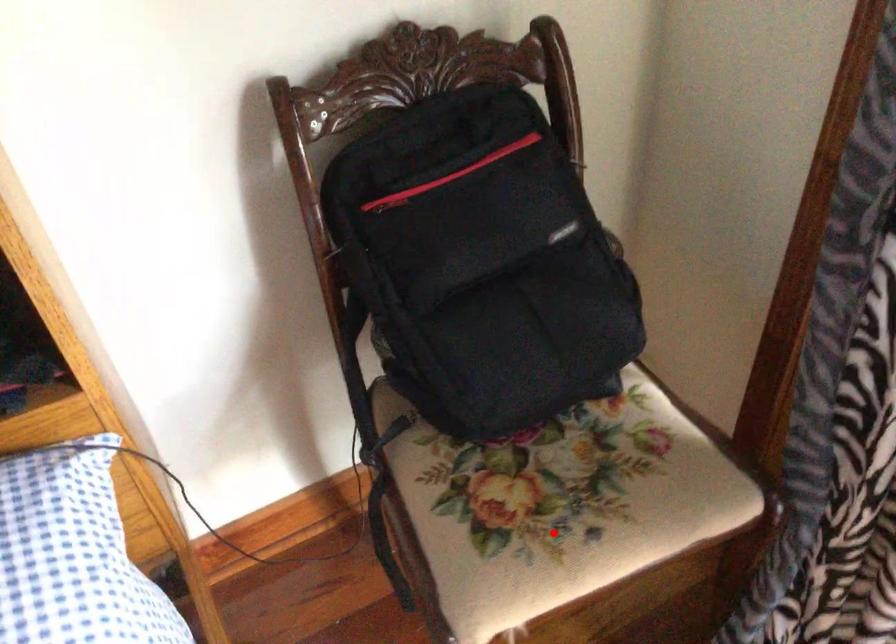
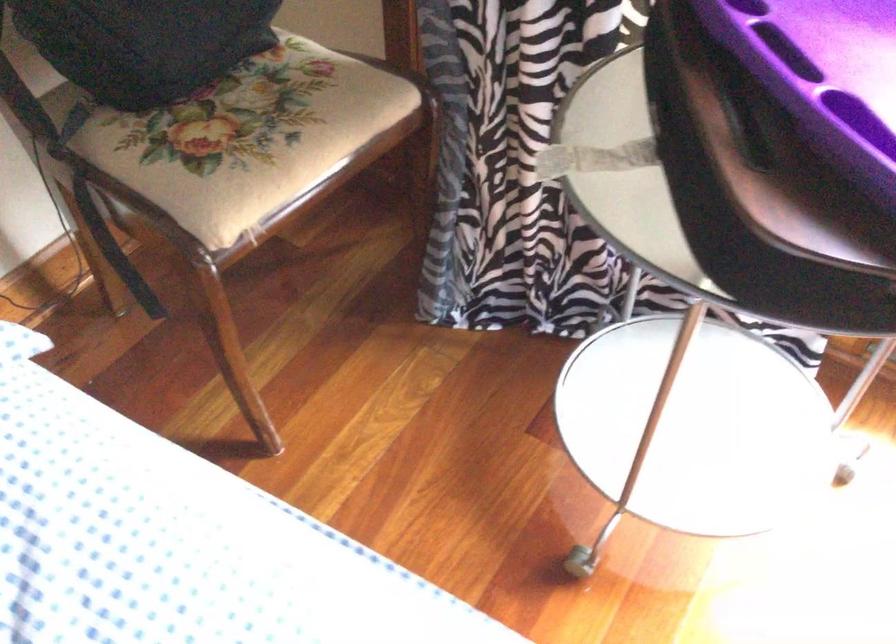
In the second image, find the point that corresponds to the highlighted location in the first image.

(259, 145)